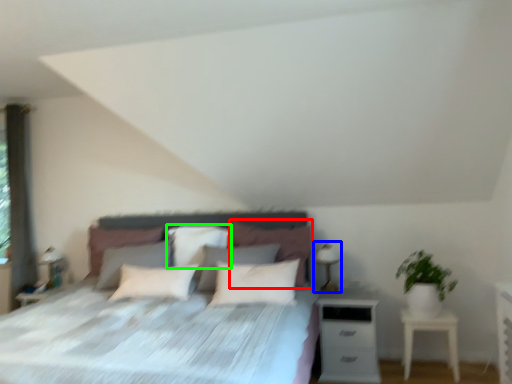
Question: Which object is the farthest from pillow (highlighted by a red box)? Choose among these: table lamp (highlighted by a blue box) or pillow (highlighted by a green box).

Choices:
 (A) table lamp
 (B) pillow

Answer: (B)